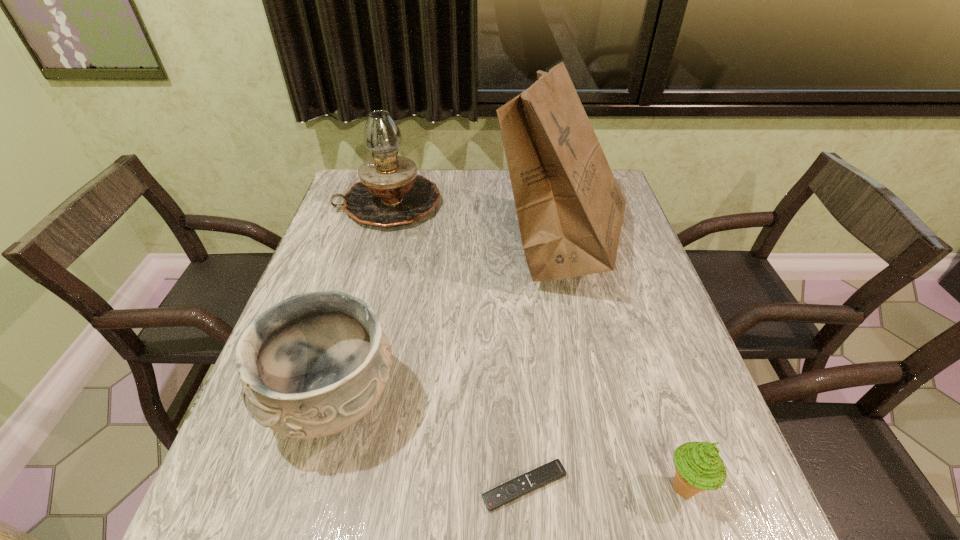
Identify the location of unoccupied area between the second shortest object and the third tallest object. This screenshot has width=960, height=540. (509, 444).

Where is `free space between the oil lamp and the fourth tallest object`? The height and width of the screenshot is (540, 960). free space between the oil lamp and the fourth tallest object is located at coordinates (536, 346).

This screenshot has height=540, width=960. Find the location of `unoccupied area between the third tallest object and the grocery bag`. unoccupied area between the third tallest object and the grocery bag is located at coordinates (446, 324).

You are a GUI agent. You are given a task and a screenshot of the screen. Output one action in this format:
    pyautogui.click(x=<x>, y=<y>)
    Task: Click on the vacant space in between the second shortest object and the remote control
    The height and width of the screenshot is (540, 960).
    Given the screenshot: What is the action you would take?
    pyautogui.click(x=604, y=487)

Locate an element on the screen. The height and width of the screenshot is (540, 960). object identified as the second closest to the tallest object is located at coordinates click(313, 365).

This screenshot has width=960, height=540. What are the coordinates of `object that stands as the third closest to the oil lamp` in the screenshot? It's located at pyautogui.click(x=554, y=470).

The height and width of the screenshot is (540, 960). Find the location of `blank space that satisfies the following two spatial constraints: 1. on the front side of the second shortest object; 2. on the right side of the third tallest object`. blank space that satisfies the following two spatial constraints: 1. on the front side of the second shortest object; 2. on the right side of the third tallest object is located at coordinates (310, 488).

Locate an element on the screen. The width and height of the screenshot is (960, 540). vacant space that satisfies the following two spatial constraints: 1. on the back side of the grocery bag; 2. on the left side of the third shortest object is located at coordinates (375, 247).